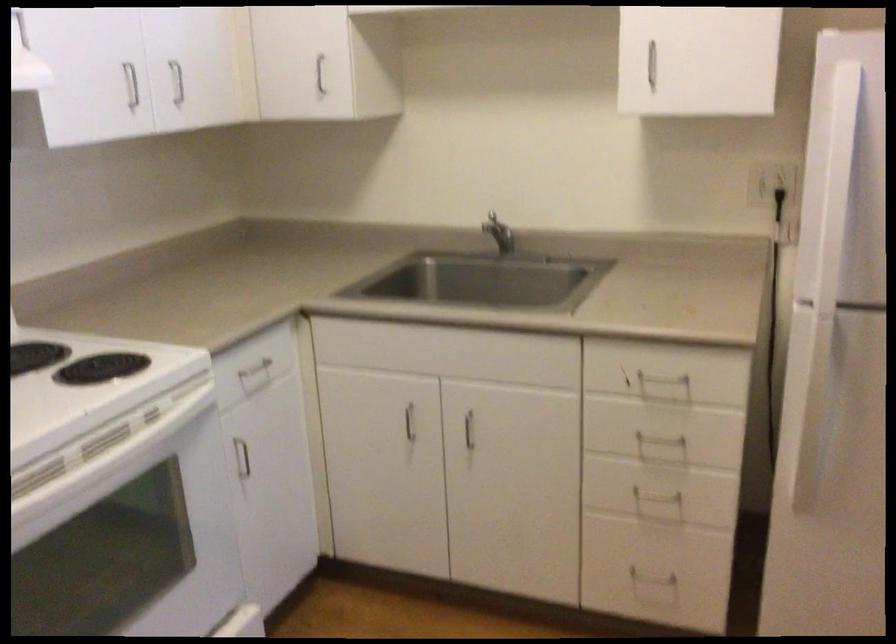
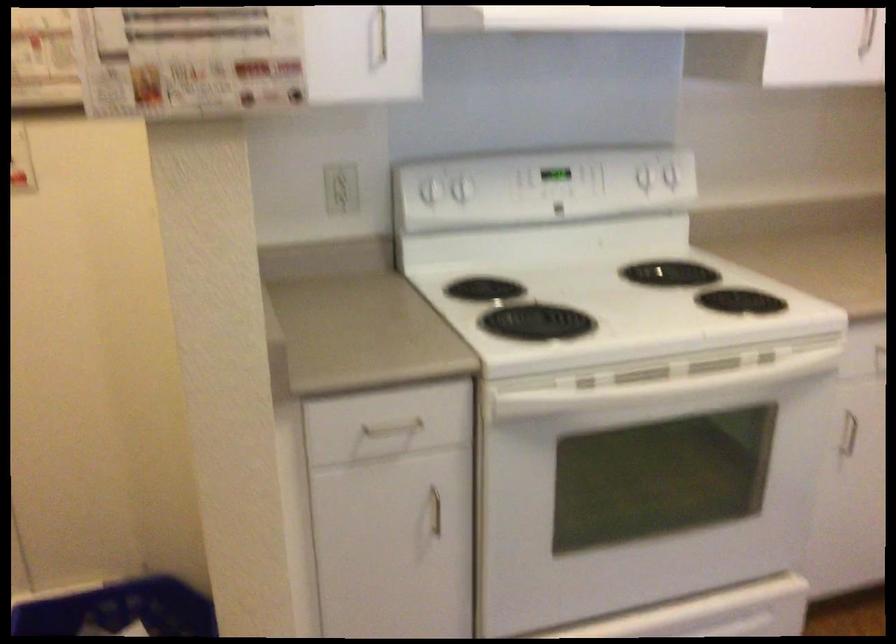
Question: The camera is either moving clockwise (left) or counter-clockwise (right) around the object. The first image is from the beginning of the video and the second image is from the end. Is the camera moving left or right when shooting the video?

Choices:
 (A) Left
 (B) Right

Answer: (B)